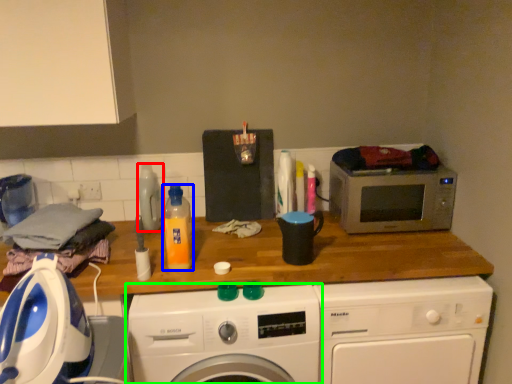
Question: Based on their relative distances, which object is nearer to bottle (highlighted by a red box)? Choose from bottle (highlighted by a blue box) and washing machine (highlighted by a green box).

Choices:
 (A) bottle
 (B) washing machine

Answer: (A)